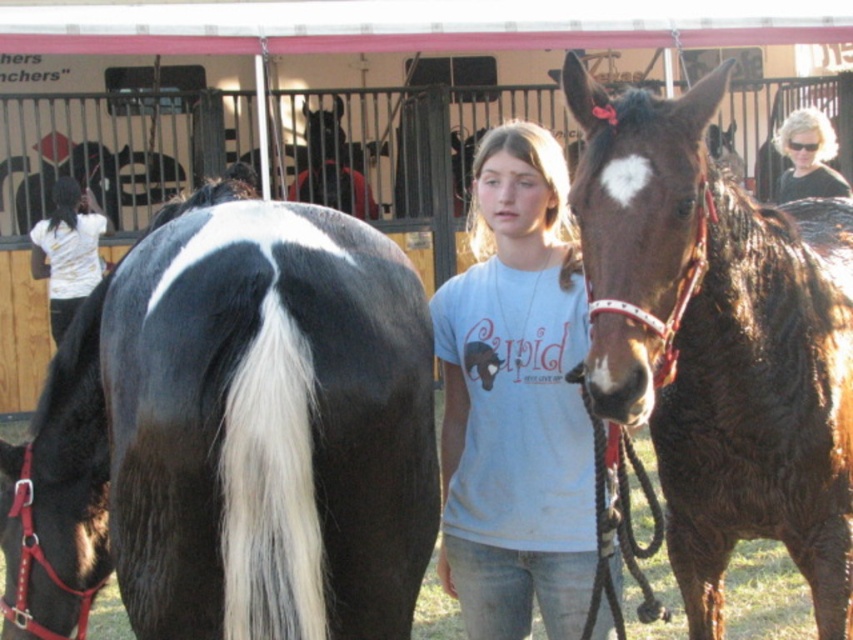
Between point (552, 609) and point (61, 218), which one is positioned behind?

The point (61, 218) is behind.

Between point (479, 378) and point (96, 257), which one is positioned behind?

Positioned behind is point (96, 257).

Locate an element on the screen. light blue cotton shirt at center is located at coordinates (515, 401).

Is light blue cotton shirt at center bigger than blonde hair at upper right?

No, light blue cotton shirt at center is not bigger than blonde hair at upper right.

Is light blue cotton shirt at center above blonde hair at upper right?

Actually, light blue cotton shirt at center is below blonde hair at upper right.

Is point (474, 227) positioned in front of point (790, 132)?

Yes, it is in front of point (790, 132).

The width and height of the screenshot is (853, 640). What are the coordinates of `light blue cotton shirt at center` in the screenshot? It's located at point(515,401).

Who is shorter, white shirt at left or blonde hair at upper right?

blonde hair at upper right is shorter.

Is white shirt at left to the right of blonde hair at upper right from the viewer's perspective?

In fact, white shirt at left is to the left of blonde hair at upper right.

Find the location of a particular element. white shirt at left is located at coordinates (67, 250).